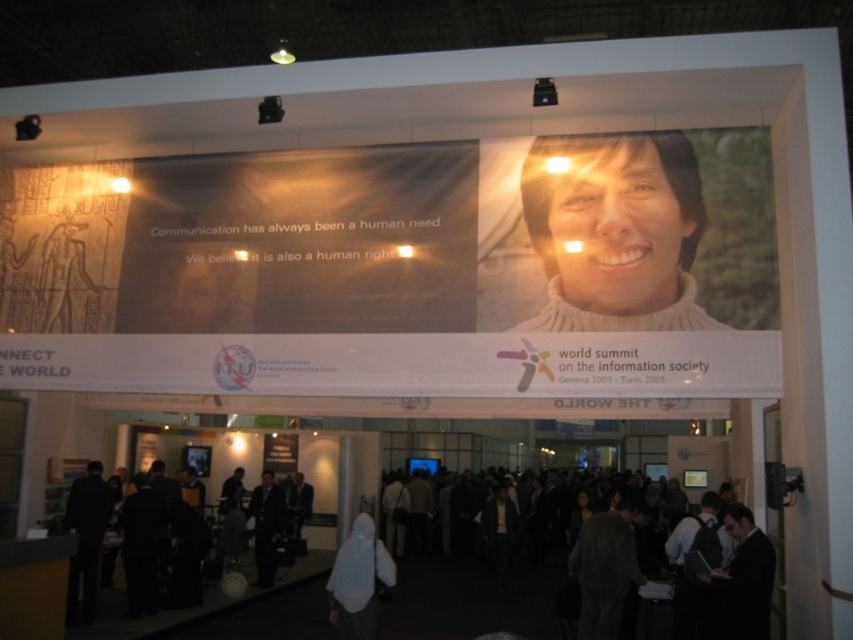
You are an attendee at the WSIS conference. You see a white fabric at lower center and a dark gray suit at lower left. Which object is located to the right of the other?

The white fabric at lower center is positioned on the right side of dark gray suit at lower left.

You are an event organizer at the WSIS summit. You need to determine if the matte white banner at upper center can be moved to the space currently occupied by the sweater at upper right. Based on their sizes, is this feasible?

The matte white banner at upper center occupies less space than the sweater at upper right. Therefore, the banner can be moved to the space currently occupied by the sweater since the sweater occupies a larger area.